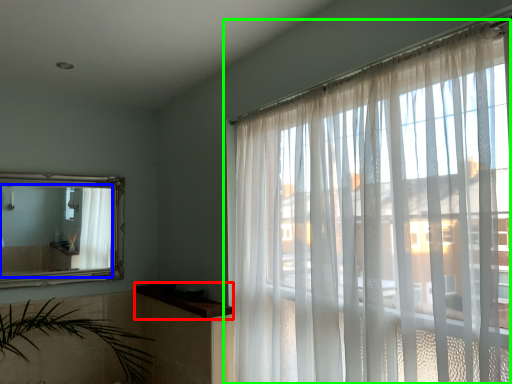
Question: Estimate the real-world distances between objects in this image. Which object is farther from window sill (highlighted by a red box), mirror (highlighted by a blue box) or window (highlighted by a green box)?

Choices:
 (A) mirror
 (B) window

Answer: (B)